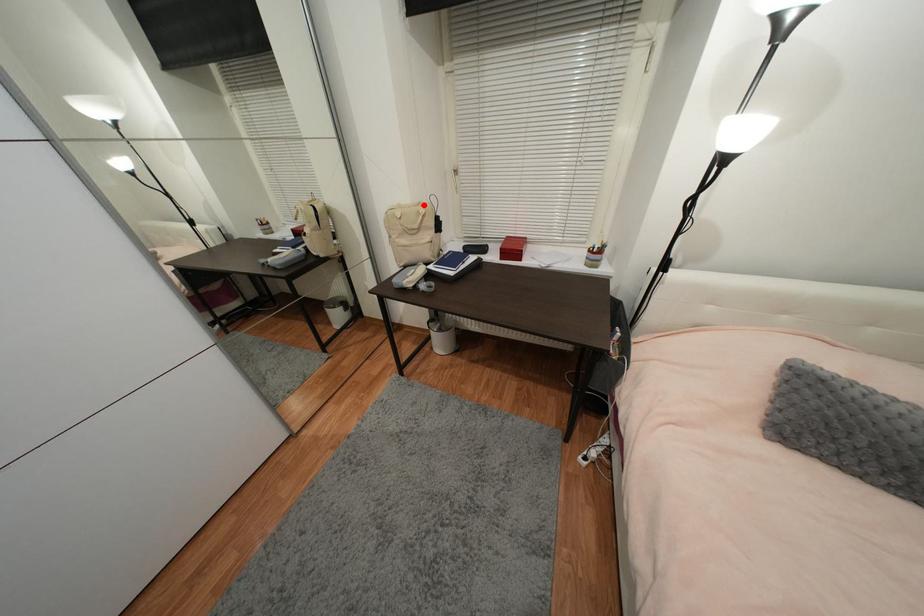
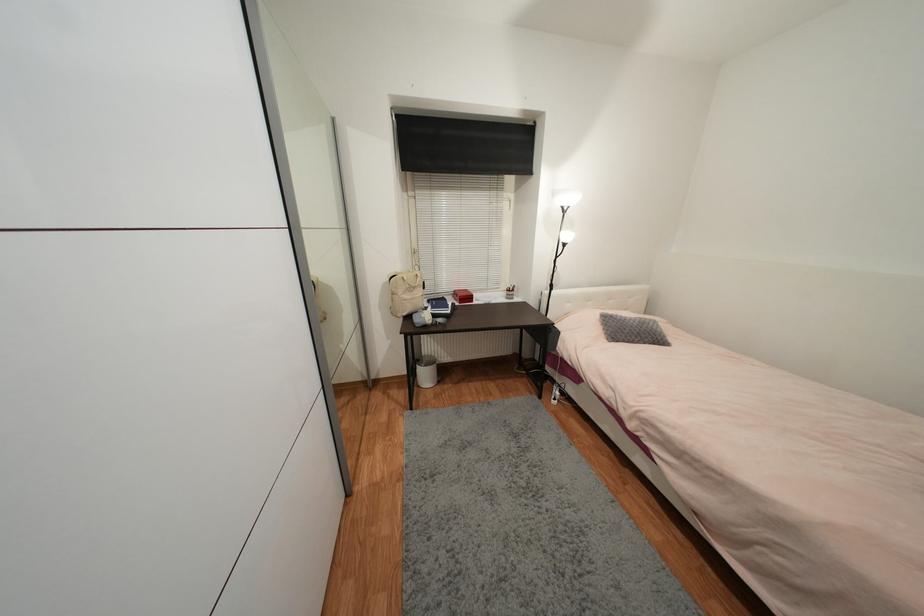
Question: I am providing you with two images of the same scene from different viewpoints. A red point is shown in image1. For the corresponding object point in image2, is it positioned nearer or farther from the camera?

Choices:
 (A) Nearer
 (B) Farther

Answer: (B)